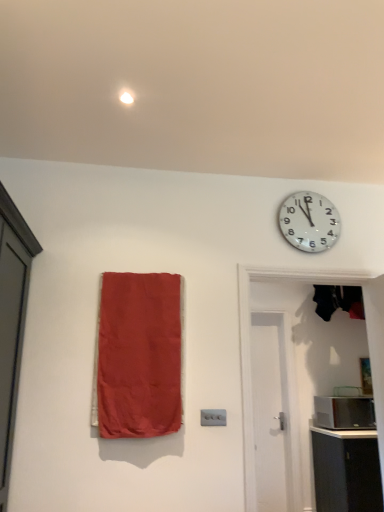
Question: Would you say matte fabric curtain at left is outside white glossy wall clock at upper right?

Choices:
 (A) no
 (B) yes

Answer: (B)

Question: Can you confirm if matte fabric curtain at left is positioned to the right of white glossy wall clock at upper right?

Choices:
 (A) no
 (B) yes

Answer: (A)

Question: Is matte fabric curtain at left facing away from white glossy wall clock at upper right?

Choices:
 (A) no
 (B) yes

Answer: (A)

Question: Can you confirm if matte fabric curtain at left is taller than white glossy wall clock at upper right?

Choices:
 (A) no
 (B) yes

Answer: (B)

Question: Can you see matte fabric curtain at left touching white glossy wall clock at upper right?

Choices:
 (A) yes
 (B) no

Answer: (B)

Question: Is black glossy microwave at right taller or shorter than white glossy wall clock at upper right?

Choices:
 (A) tall
 (B) short

Answer: (B)

Question: From the image's perspective, is black glossy microwave at right positioned above or below white glossy wall clock at upper right?

Choices:
 (A) above
 (B) below

Answer: (B)

Question: Considering the relative positions of black glossy microwave at right and white glossy wall clock at upper right in the image provided, is black glossy microwave at right to the left or to the right of white glossy wall clock at upper right?

Choices:
 (A) left
 (B) right

Answer: (B)

Question: Considering their positions, is black glossy microwave at right located in front of or behind white glossy wall clock at upper right?

Choices:
 (A) front
 (B) behind

Answer: (B)

Question: From a real-world perspective, is matte fabric curtain at left above or below white matte door at right, which ranks as the first door in front-to-back order?

Choices:
 (A) below
 (B) above

Answer: (B)

Question: In terms of height, does matte fabric curtain at left look taller or shorter compared to white matte door at right, the second door viewed from the back?

Choices:
 (A) tall
 (B) short

Answer: (B)

Question: Considering the positions of point (157, 373) and point (254, 488), is point (157, 373) closer or farther from the camera than point (254, 488)?

Choices:
 (A) farther
 (B) closer

Answer: (B)

Question: Considering their positions, is matte fabric curtain at left located in front of or behind white matte door at right, which ranks as the first door in front-to-back order?

Choices:
 (A) behind
 (B) front

Answer: (B)

Question: In terms of width, does matte black cabinet at lower right look wider or thinner when compared to white wooden door at right, the 2th door in the front-to-back sequence?

Choices:
 (A) thin
 (B) wide

Answer: (B)

Question: Is point click(357, 450) positioned closer to the camera than point click(281, 464)?

Choices:
 (A) farther
 (B) closer

Answer: (B)